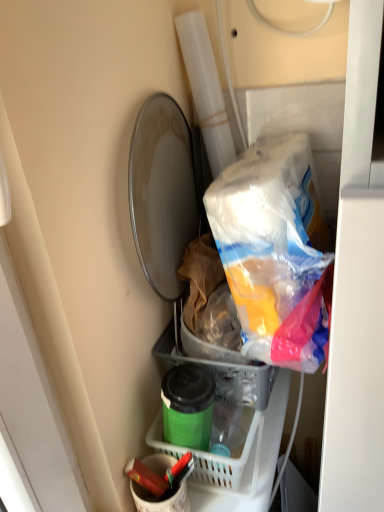
Question: Is green matte container at lower center spatially inside matte red crayon at lower center, or outside of it?

Choices:
 (A) outside
 (B) inside

Answer: (A)

Question: From the image's perspective, is green matte container at lower center above or below matte red crayon at lower center?

Choices:
 (A) below
 (B) above

Answer: (B)

Question: Estimate the real-world distances between objects in this image. Which object is closer to the green matte container at lower center?

Choices:
 (A) matte red crayon at lower center
 (B) green plastic basket at lower center
 (C) matte white bucket at lower center

Answer: (B)

Question: Based on their relative distances, which object is farther from the green matte container at lower center?

Choices:
 (A) matte red crayon at lower center
 (B) green plastic basket at lower center
 (C) matte white bucket at lower center

Answer: (A)